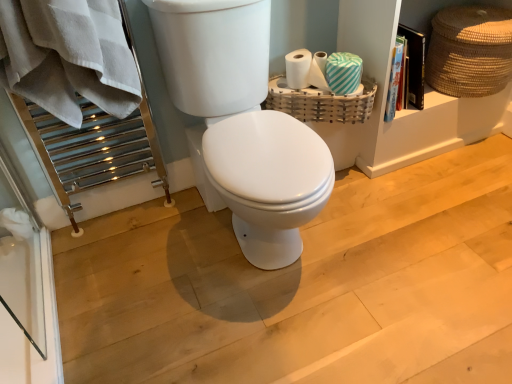
Question: Is braided straw basket at upper right, the 2th basket viewed from the left, closer to the viewer compared to white glossy toilet at center?

Choices:
 (A) no
 (B) yes

Answer: (A)

Question: Is braided straw basket at upper right, the 2th basket viewed from the left, facing towards white glossy toilet at center?

Choices:
 (A) yes
 (B) no

Answer: (B)

Question: From the image's perspective, would you say braided straw basket at upper right, which is the 1th basket in right-to-left order, is positioned over white glossy toilet at center?

Choices:
 (A) no
 (B) yes

Answer: (B)

Question: From the image's perspective, is braided straw basket at upper right, the 2th basket viewed from the left, below white glossy toilet at center?

Choices:
 (A) no
 (B) yes

Answer: (A)

Question: Is braided straw basket at upper right, the 2th basket viewed from the left, surrounding white glossy toilet at center?

Choices:
 (A) no
 (B) yes

Answer: (A)

Question: From their relative heights in the image, would you say braided straw basket at upper right, the 2th basket viewed from the left, is taller or shorter than white cotton bath towel at left?

Choices:
 (A) tall
 (B) short

Answer: (B)

Question: Is braided straw basket at upper right, the 2th basket viewed from the left, bigger or smaller than white cotton bath towel at left?

Choices:
 (A) big
 (B) small

Answer: (B)

Question: From a real-world perspective, relative to white cotton bath towel at left, is braided straw basket at upper right, which is the 1th basket in right-to-left order, vertically above or below?

Choices:
 (A) above
 (B) below

Answer: (B)

Question: Does point (444, 91) appear closer or farther from the camera than point (61, 41)?

Choices:
 (A) farther
 (B) closer

Answer: (A)

Question: From a real-world perspective, is white glossy toilet at center positioned above or below braided straw basket at upper right, the 2th basket viewed from the left?

Choices:
 (A) below
 (B) above

Answer: (B)

Question: From the image's perspective, is white glossy toilet at center above or below braided straw basket at upper right, the 2th basket viewed from the left?

Choices:
 (A) above
 (B) below

Answer: (B)

Question: Based on their sizes in the image, would you say white glossy toilet at center is bigger or smaller than braided straw basket at upper right, which is the 1th basket in right-to-left order?

Choices:
 (A) small
 (B) big

Answer: (B)

Question: Is point (166, 13) closer or farther from the camera than point (480, 56)?

Choices:
 (A) closer
 (B) farther

Answer: (A)

Question: Considering the positions of white textured toilet paper at upper right, acting as the second toilet paper starting from the right, and white glossy toilet at center in the image, is white textured toilet paper at upper right, acting as the second toilet paper starting from the right, taller or shorter than white glossy toilet at center?

Choices:
 (A) tall
 (B) short

Answer: (B)

Question: Is white textured toilet paper at upper right, the 1th toilet paper in the left-to-right sequence, inside the boundaries of white glossy toilet at center, or outside?

Choices:
 (A) inside
 (B) outside

Answer: (B)